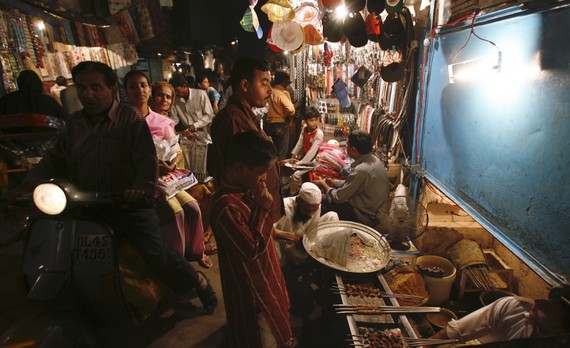
Locate an element on the screen. The height and width of the screenshot is (348, 570). pot is located at coordinates (441, 285).